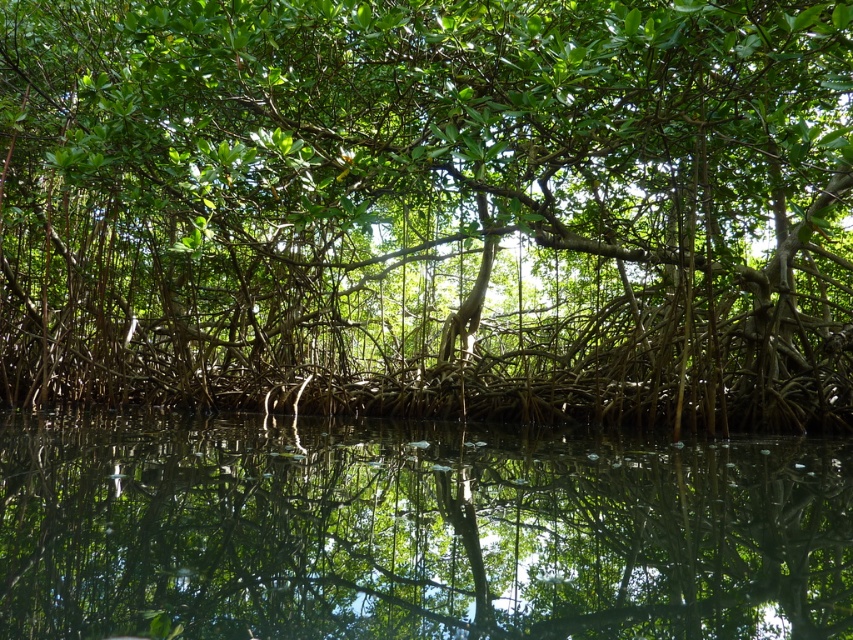
Is green leafy tree at center closer to camera compared to transparent water at center?

That is False.

Is green leafy tree at center positioned at the back of transparent water at center?

Yes, it is.

This screenshot has height=640, width=853. Find the location of `green leafy tree at center`. green leafy tree at center is located at coordinates (431, 209).